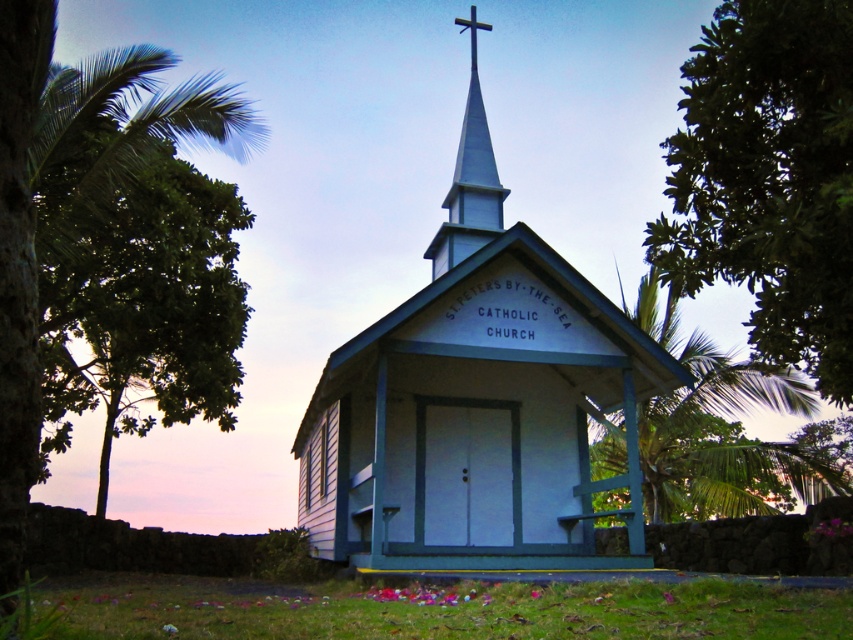
You are standing in front of the white wood chapel at center and the white smooth steeple at center. Which object is closer to you?

The white wood chapel at center is closer to you because it is in front of the white smooth steeple at center.